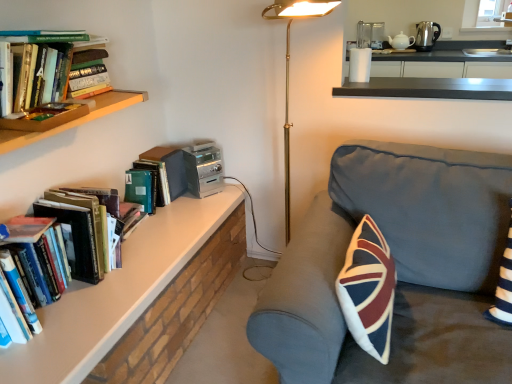
Question: Is white ceramic teapot at upper right, arranged as the 2th appliance when viewed from the top, aimed at hardcover book at upper left, the 1th book viewed from the back?

Choices:
 (A) no
 (B) yes

Answer: (B)

Question: Does white ceramic teapot at upper right, arranged as the 2th appliance when viewed from the top, have a smaller size compared to hardcover book at upper left, which appears as the third book when viewed from the front?

Choices:
 (A) no
 (B) yes

Answer: (B)

Question: Are white ceramic teapot at upper right, placed as the 2th appliance when sorted from left to right, and hardcover book at upper left, the 1th book viewed from the back, far apart?

Choices:
 (A) no
 (B) yes

Answer: (B)

Question: Can you confirm if white ceramic teapot at upper right, acting as the second appliance starting from the right, is positioned to the right of hardcover book at upper left, the 1th book viewed from the back?

Choices:
 (A) yes
 (B) no

Answer: (A)

Question: Is the position of white ceramic teapot at upper right, marked as the 3th appliance in a front-to-back arrangement, more distant than that of hardcover book at upper left, the 1th book viewed from the back?

Choices:
 (A) no
 (B) yes

Answer: (B)

Question: Based on their sizes in the image, would you say white ceramic teapot at upper right, arranged as the 2th appliance when viewed from the top, is bigger or smaller than gold metallic floor lamp at center?

Choices:
 (A) small
 (B) big

Answer: (A)

Question: From the image's perspective, is white ceramic teapot at upper right, which ranks as the 1th appliance in back-to-front order, located above or below gold metallic floor lamp at center?

Choices:
 (A) above
 (B) below

Answer: (A)

Question: Is white ceramic teapot at upper right, arranged as the 2th appliance when viewed from the top, inside or outside of gold metallic floor lamp at center?

Choices:
 (A) inside
 (B) outside

Answer: (B)

Question: Considering the positions of white ceramic teapot at upper right, arranged as the 2th appliance when viewed from the top, and gold metallic floor lamp at center in the image, is white ceramic teapot at upper right, arranged as the 2th appliance when viewed from the top, wider or thinner than gold metallic floor lamp at center?

Choices:
 (A) wide
 (B) thin

Answer: (B)

Question: Is polished stainless steel kettle at upper right, which is the 2th appliance in back-to-front order, in front of or behind silver metallic stereo at upper center, the 3th appliance in the back-to-front sequence, in the image?

Choices:
 (A) behind
 (B) front

Answer: (A)

Question: Which is correct: polished stainless steel kettle at upper right, which is the 1th appliance in right-to-left order, is inside silver metallic stereo at upper center, the third appliance viewed from the right, or outside of it?

Choices:
 (A) inside
 (B) outside

Answer: (B)

Question: Is polished stainless steel kettle at upper right, the third appliance positioned from the bottom, wider or thinner than silver metallic stereo at upper center, marked as the 1th appliance in a bottom-to-top arrangement?

Choices:
 (A) thin
 (B) wide

Answer: (A)

Question: Is point (418, 29) positioned closer to the camera than point (194, 183)?

Choices:
 (A) farther
 (B) closer

Answer: (A)

Question: Choose the correct answer: Is dark gray fabric couch at center inside gold metallic floor lamp at center or outside it?

Choices:
 (A) outside
 (B) inside

Answer: (A)

Question: In terms of width, does dark gray fabric couch at center look wider or thinner when compared to gold metallic floor lamp at center?

Choices:
 (A) wide
 (B) thin

Answer: (A)